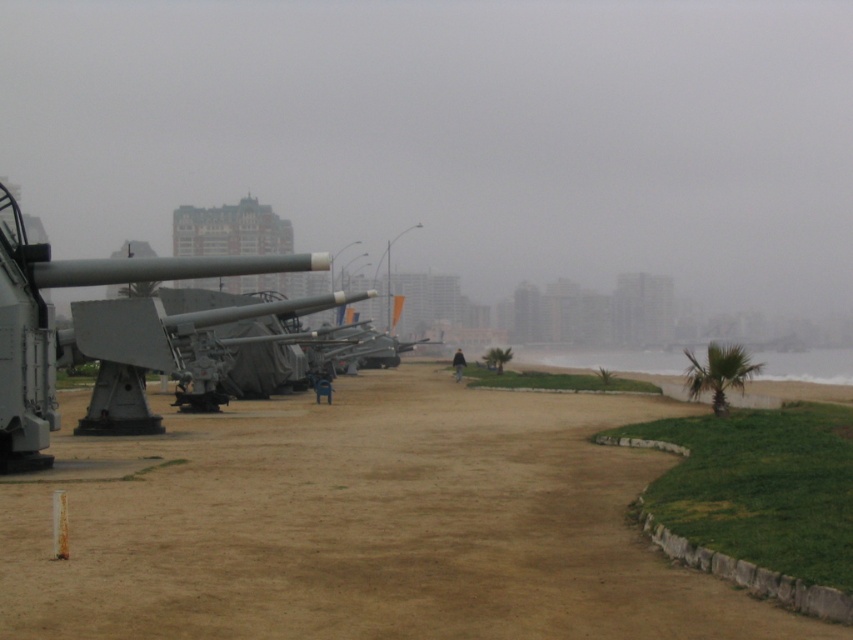
You are a photographer planning to capture a wide shot of the gray metallic cannon at left and the brown sandy dirt at center. Based on their sizes, which object will occupy more space in the photo?

The brown sandy dirt at center will occupy more space in the photo because its width surpasses that of the gray metallic cannon at left.

You are a drone operator trying to land a drone on a flat surface. You see the brown sandy dirt at center. Can you land the drone there?

Yes, you can land the drone on the brown sandy dirt at center because it is a flat surface located at point coordinates of (364,524).